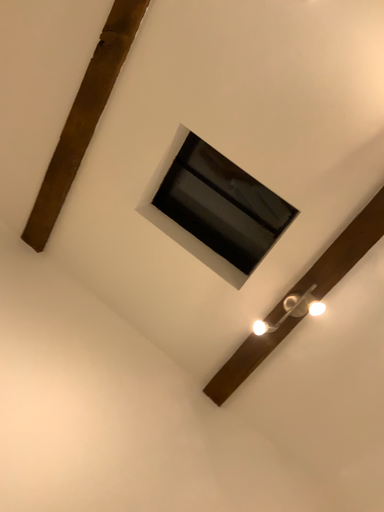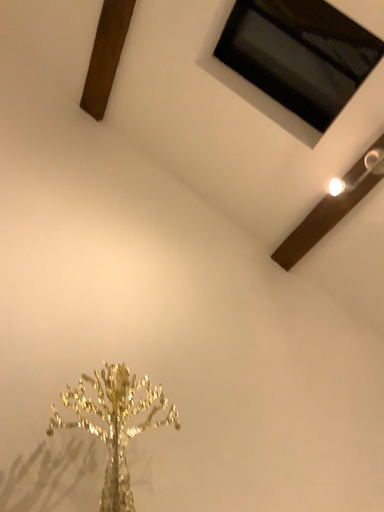
Question: How did the camera likely rotate when shooting the video?

Choices:
 (A) rotated upward
 (B) rotated downward

Answer: (B)